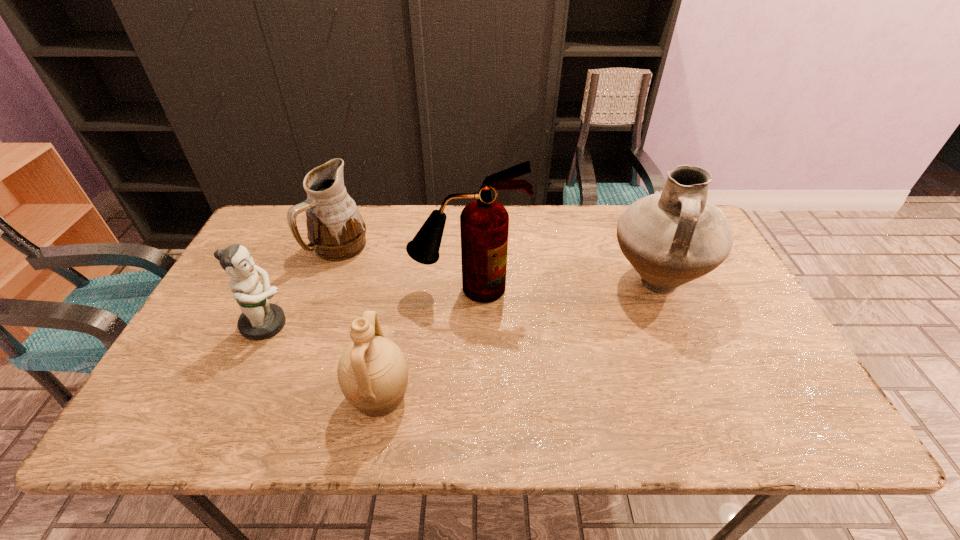
In the image, there is a desktop. Identify the location of free space at the far left corner. The image size is (960, 540). (272, 205).

Locate an element on the screen. vacant space at the near left corner of the desktop is located at coordinates (194, 410).

Where is `vacant space that is in between the figurine and the rightmost pitcher`? This screenshot has width=960, height=540. vacant space that is in between the figurine and the rightmost pitcher is located at coordinates (461, 303).

Identify the location of vacant space in between the rightmost object and the fire extinguisher. (562, 286).

This screenshot has height=540, width=960. I want to click on empty location between the nearest object and the fire extinguisher, so click(424, 343).

The height and width of the screenshot is (540, 960). What are the coordinates of `free space that is in between the leftmost pitcher and the figurine` in the screenshot? It's located at 303,286.

The height and width of the screenshot is (540, 960). Identify the location of empty space between the figurine and the leftmost pitcher. (303, 286).

Identify the location of empty space that is in between the fire extinguisher and the leftmost pitcher. (404, 268).

The height and width of the screenshot is (540, 960). In order to click on vacant space in between the rightmost pitcher and the nearest pitcher in this screenshot , I will do `click(517, 340)`.

Where is `the third closest object to the figurine`? The height and width of the screenshot is (540, 960). the third closest object to the figurine is located at coordinates (484, 223).